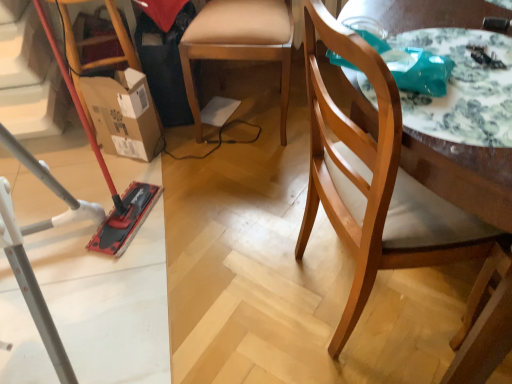
Identify the location of free space to the left of cardboard box at left. The width and height of the screenshot is (512, 384). (84, 171).